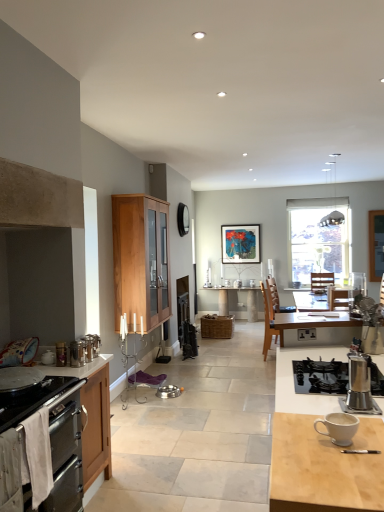
The height and width of the screenshot is (512, 384). I want to click on brown woven picnic basket at center, so click(x=217, y=326).

The width and height of the screenshot is (384, 512). I want to click on stainless steel oven at lower left, the 1th cabinetry viewed from the front, so click(x=56, y=439).

The height and width of the screenshot is (512, 384). What do you see at coordinates (169, 391) in the screenshot?
I see `metallic stainless steel pet bowls at center, which is the 1th kitchen appliance from back to front` at bounding box center [169, 391].

What do you see at coordinates (268, 321) in the screenshot? I see `wooden chair at center` at bounding box center [268, 321].

The width and height of the screenshot is (384, 512). In order to click on matte white sink at lower left in this screenshot , I will do `click(19, 352)`.

From the image's perspective, relative to light wood desk at right, arranged as the 2th desk when viewed from the back, is matte black picture frame at center above or below?

From the image's perspective, matte black picture frame at center appears above light wood desk at right, arranged as the 2th desk when viewed from the back.

Considering the sizes of matte black picture frame at center and light wood desk at right, arranged as the 2th desk when viewed from the back, in the image, is matte black picture frame at center bigger or smaller than light wood desk at right, arranged as the 2th desk when viewed from the back,?

matte black picture frame at center is smaller than light wood desk at right, arranged as the 2th desk when viewed from the back.

Between matte black picture frame at center and light wood desk at right, marked as the 1th desk in a front-to-back arrangement, which one has less height?

matte black picture frame at center.

Considering the positions of points (246, 234) and (282, 438), is point (246, 234) closer to camera compared to point (282, 438)?

No, (246, 234) is further to viewer.

Considering the sizes of objects matte black picture frame at center and wooden chair at center in the image provided, who is smaller, matte black picture frame at center or wooden chair at center?

matte black picture frame at center.

From a real-world perspective, between matte black picture frame at center and wooden chair at center, who is vertically lower?

wooden chair at center.

Is matte black picture frame at center located outside wooden chair at center?

matte black picture frame at center lies outside wooden chair at center's area.

In order to click on chair located below the matte black picture frame at center (from the image's perspective) in this screenshot , I will do `click(268, 321)`.

Is point (21, 493) positioned after point (171, 387)?

No, (21, 493) is in front of (171, 387).

Which cabinetry is the 2nd one when counting from the left side of the metallic stainless steel pet bowls at center, which is the 1th kitchen appliance from right to left? Please provide its 2D coordinates.

[(56, 439)]

How many degrees apart are the facing directions of stainless steel oven at lower left, the 1th cabinetry viewed from the front, and metallic stainless steel pet bowls at center, the second kitchen appliance in the left-to-right sequence?

The angular difference between stainless steel oven at lower left, the 1th cabinetry viewed from the front, and metallic stainless steel pet bowls at center, the second kitchen appliance in the left-to-right sequence, is 2.28 degrees.

From a real-world perspective, between stainless steel oven at lower left, the second cabinetry from the back, and metallic stainless steel pet bowls at center, the 2th kitchen appliance from the top, who is vertically higher?

stainless steel oven at lower left, the second cabinetry from the back, from a real-world perspective.

Is stainless steel gas stove at lower left to the left or to the right of metallic stainless steel pet bowls at center, the 2th kitchen appliance from the top, in the image?

Based on their positions, stainless steel gas stove at lower left is located to the left of metallic stainless steel pet bowls at center, the 2th kitchen appliance from the top.

From the image's perspective, which is below, stainless steel gas stove at lower left or metallic stainless steel pet bowls at center, which is the 1th kitchen appliance from right to left?

metallic stainless steel pet bowls at center, which is the 1th kitchen appliance from right to left, appears lower in the image.

Is stainless steel gas stove at lower left beside metallic stainless steel pet bowls at center, which is the 1th kitchen appliance from back to front?

No.

Is matte white sink at lower left positioned with its back to wooden chair at center?

No.

Is wooden chair at center inside matte white sink at lower left?

Actually, wooden chair at center is outside matte white sink at lower left.

Considering the sizes of objects matte white sink at lower left and wooden chair at center in the image provided, who is thinner, matte white sink at lower left or wooden chair at center?

Thinner between the two is matte white sink at lower left.

Considering the positions of point (14, 345) and point (265, 324), is point (14, 345) closer or farther from the camera than point (265, 324)?

Point (14, 345) is positioned closer to the camera compared to point (265, 324).

From a real-world perspective, relative to black plastic power outlet at center, is satin silver coffee maker at lower right vertically above or below?

From a real-world perspective, satin silver coffee maker at lower right is physically above black plastic power outlet at center.

From the image's perspective, which one is positioned higher, satin silver coffee maker at lower right or black plastic power outlet at center?

satin silver coffee maker at lower right.

Is black plastic power outlet at center a part of satin silver coffee maker at lower right?

Definitely not — black plastic power outlet at center is not inside satin silver coffee maker at lower right.

Considering the positions of point (368, 394) and point (305, 337), is point (368, 394) closer or farther from the camera than point (305, 337)?

Point (368, 394).

Does wooden chair at center turn towards brown woven picnic basket at center?

No, wooden chair at center is not facing towards brown woven picnic basket at center.

Visually, is wooden chair at center positioned to the left or to the right of brown woven picnic basket at center?

wooden chair at center is to the right of brown woven picnic basket at center.

From the image's perspective, between wooden chair at center and brown woven picnic basket at center, who is located below?

brown woven picnic basket at center appears lower in the image.

Considering the sizes of wooden chair at center and brown woven picnic basket at center in the image, is wooden chair at center taller or shorter than brown woven picnic basket at center?

wooden chair at center is taller than brown woven picnic basket at center.

Where is `picture frame that is behind the light wood desk at right, marked as the 1th desk in a front-to-back arrangement`? This screenshot has height=512, width=384. picture frame that is behind the light wood desk at right, marked as the 1th desk in a front-to-back arrangement is located at coordinates (240, 244).

Locate an element on the screen. picture frame above the wooden chair at center (from the image's perspective) is located at coordinates tap(240, 244).

From the image, which object appears to be nearer to white ceramic mug at lower right, light wood desk at right, marked as the 1th desk in a front-to-back arrangement, or metallic silver canister at left, the 1th kitchen appliance viewed from the top?

light wood desk at right, marked as the 1th desk in a front-to-back arrangement, lies closer to white ceramic mug at lower right than the other object.

Based on their spatial positions, is wooden chair at center or matte black picture frame at center closer to matte white sink at lower left?

The object closer to matte white sink at lower left is wooden chair at center.

Estimate the real-world distances between objects in this image. Which object is further from matte white sink at lower left, wooden chair at center or metallic stainless steel pet bowls at center, which appears as the first kitchen appliance when ordered from the bottom?

The object further to matte white sink at lower left is metallic stainless steel pet bowls at center, which appears as the first kitchen appliance when ordered from the bottom.

Based on their spatial positions, is metallic silver canister at left, acting as the 2th kitchen appliance starting from the bottom, or light wood desk at right, marked as the 1th desk in a front-to-back arrangement, closer to brown woven picnic basket at center?

The object closer to brown woven picnic basket at center is metallic silver canister at left, acting as the 2th kitchen appliance starting from the bottom.

Considering their positions, is white fabric oven at left positioned closer to matte white sink at lower left than metallic silver canister at left, which ranks as the second kitchen appliance in right-to-left order?

metallic silver canister at left, which ranks as the second kitchen appliance in right-to-left order, is positioned closer to the anchor matte white sink at lower left.

From the image, which object appears to be nearer to satin silver coffee maker at lower right, stainless steel oven at lower left, the 1th cabinetry positioned from the bottom, or white ceramic mug at lower right?

white ceramic mug at lower right.

When comparing their distances from light brown wood cabinet at center, acting as the first cabinetry starting from the back, does matte white sink at lower left or matte black picture frame at center seem further?

Among the two, matte black picture frame at center is located further to light brown wood cabinet at center, acting as the first cabinetry starting from the back.

Looking at the image, which one is located closer to black plastic power outlet at center, brown woven picnic basket at center or metallic silver canister at left?

Among the two, metallic silver canister at left is located nearer to black plastic power outlet at center.

Find the location of a particular element. This screenshot has height=512, width=384. kitchen appliance between metallic silver canister at left and matte black picture frame at center along the z-axis is located at coordinates (169, 391).

Identify the location of coffee maker between stainless steel gas stove at lower left and matte black picture frame at center along the z-axis. This screenshot has width=384, height=512. (359, 383).

Where is `power outlet between stainless steel oven at lower left, the second cabinetry from the back, and light brown wood cabinet at center, the 2th cabinetry when ordered from bottom to top, in the front-back direction`? Image resolution: width=384 pixels, height=512 pixels. power outlet between stainless steel oven at lower left, the second cabinetry from the back, and light brown wood cabinet at center, the 2th cabinetry when ordered from bottom to top, in the front-back direction is located at coordinates (306, 334).

What are the coordinates of `cabinetry between black plastic power outlet at center and matte glass desk at center, positioned as the 1th desk in back-to-front order, from front to back` in the screenshot? It's located at (141, 259).